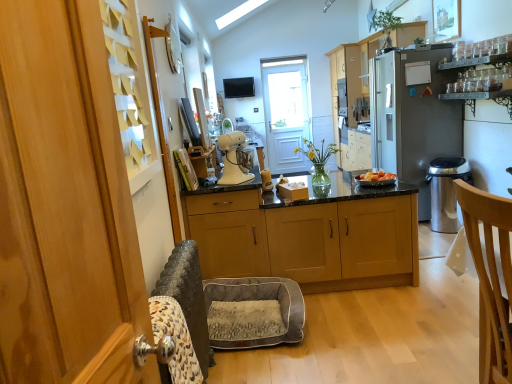
Question: Which direction should I rotate to look at translucent glass vase at center, positioned as the second houseplant in back-to-front order, — up or down?

Choices:
 (A) up
 (B) down

Answer: (A)

Question: Is satin black oven at upper center at the left side of satin silver refrigerator at right?

Choices:
 (A) no
 (B) yes

Answer: (B)

Question: Does satin black oven at upper center have a smaller size compared to satin silver refrigerator at right?

Choices:
 (A) no
 (B) yes

Answer: (B)

Question: Is satin black oven at upper center far away from satin silver refrigerator at right?

Choices:
 (A) yes
 (B) no

Answer: (A)

Question: Is satin silver refrigerator at right surrounded by satin black oven at upper center?

Choices:
 (A) yes
 (B) no

Answer: (B)

Question: Could you tell me if satin black oven at upper center is turned towards satin silver refrigerator at right?

Choices:
 (A) no
 (B) yes

Answer: (A)

Question: Is the position of satin black oven at upper center more distant than that of satin silver refrigerator at right?

Choices:
 (A) yes
 (B) no

Answer: (B)

Question: From a real-world perspective, is wooden cabinets at center, which appears as the 1th cabinetry when viewed from the front, under satin black oven at upper center?

Choices:
 (A) no
 (B) yes

Answer: (B)

Question: Is the position of wooden cabinets at center, the 2th cabinetry in the right-to-left sequence, more distant than that of satin black oven at upper center?

Choices:
 (A) yes
 (B) no

Answer: (B)

Question: Is satin black oven at upper center located within wooden cabinets at center, the first cabinetry in the bottom-to-top sequence?

Choices:
 (A) no
 (B) yes

Answer: (A)

Question: Would you say wooden cabinets at center, which appears as the 1th cabinetry when viewed from the front, is outside satin black oven at upper center?

Choices:
 (A) yes
 (B) no

Answer: (A)

Question: Is the surface of wooden cabinets at center, the 2th cabinetry in the right-to-left sequence, in direct contact with satin black oven at upper center?

Choices:
 (A) yes
 (B) no

Answer: (B)

Question: Is wooden cabinets at center, which appears as the 1th cabinetry when viewed from the front, to the right of satin black oven at upper center from the viewer's perspective?

Choices:
 (A) yes
 (B) no

Answer: (A)

Question: From a real-world perspective, is white glossy stand mixer at center on top of green leafy plant at upper center, which is the first houseplant in right-to-left order?

Choices:
 (A) no
 (B) yes

Answer: (A)